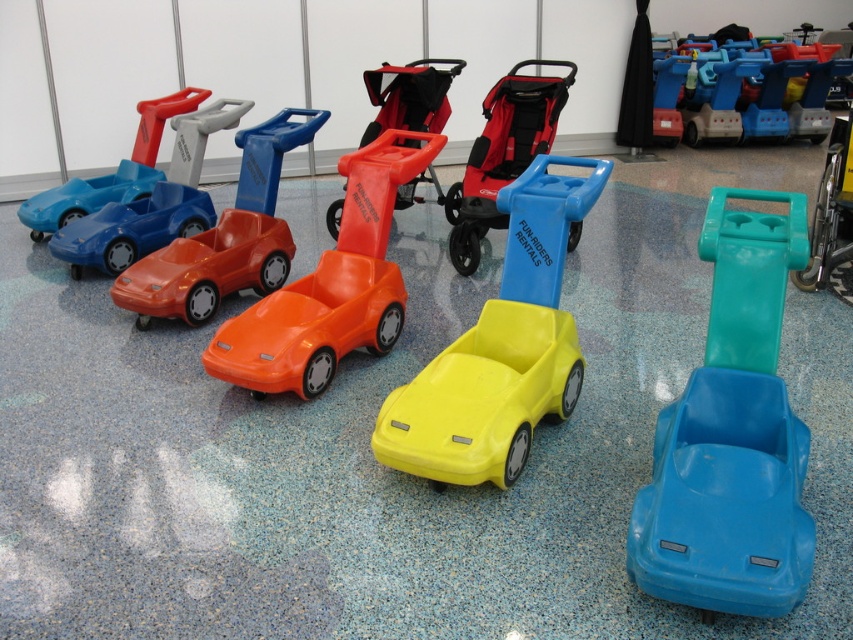
Question: Does orange plastic car at center appear over matte blue car at left?

Choices:
 (A) yes
 (B) no

Answer: (B)

Question: Which point is farther from the camera taking this photo?

Choices:
 (A) (697, 596)
 (B) (506, 348)
 (C) (274, 276)

Answer: (C)

Question: Among these objects, which one is farthest from the camera?

Choices:
 (A) matte orange car at center-left
 (B) orange plastic car at center

Answer: (A)

Question: Which object is positioned closest to the matte orange car at center-left?

Choices:
 (A) blue plastic car at center
 (B) yellow matte car at center

Answer: (B)

Question: Can you confirm if orange matte plastic car at center-left is thinner than matte plastic stroller at center?

Choices:
 (A) yes
 (B) no

Answer: (B)

Question: Is orange matte plastic car at center-left positioned before orange matte toy car at center?

Choices:
 (A) yes
 (B) no

Answer: (B)